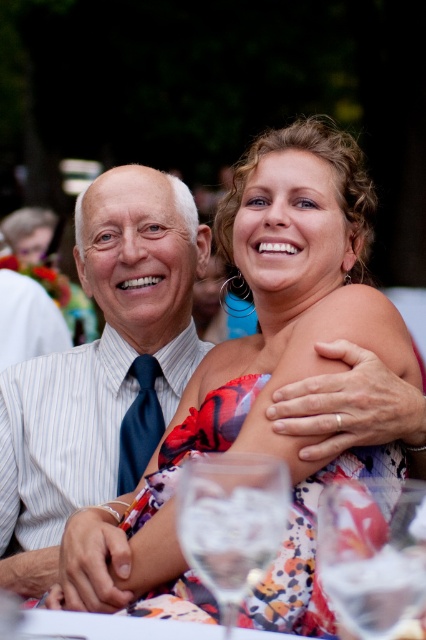
Question: Which of these objects is positioned closest to the clear glass wine glass at lower center?

Choices:
 (A) floral dress at center
 (B) white striped shirt at left

Answer: (A)

Question: Does white striped shirt at left have a greater width compared to clear glass wine glass at lower center?

Choices:
 (A) no
 (B) yes

Answer: (B)

Question: Which point is farther to the camera?

Choices:
 (A) floral dress at center
 (B) white striped shirt at left

Answer: (B)

Question: Among these objects, which one is farthest from the camera?

Choices:
 (A) clear glass wine glass at lower center
 (B) white striped shirt at left

Answer: (B)

Question: Is the position of floral dress at center more distant than that of clear glass wine glass at lower center?

Choices:
 (A) no
 (B) yes

Answer: (B)

Question: Where is white striped shirt at left located in relation to clear glass wine glass at lower center in the image?

Choices:
 (A) above
 (B) below

Answer: (A)